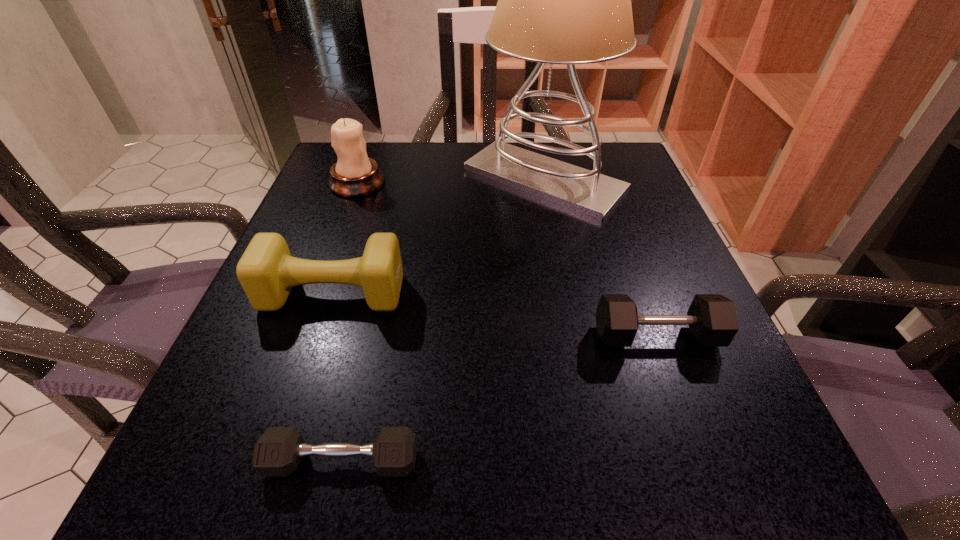
Locate an element on the screen. Image resolution: width=960 pixels, height=540 pixels. the tallest object is located at coordinates (566, 0).

Find the location of `candle holder`. candle holder is located at coordinates 354,174.

Image resolution: width=960 pixels, height=540 pixels. What are the coordinates of `the third shortest object` in the screenshot? It's located at (267, 272).

Where is `the tallest dumbbell`? The width and height of the screenshot is (960, 540). the tallest dumbbell is located at coordinates (267, 272).

Locate an element on the screen. The height and width of the screenshot is (540, 960). the rightmost dumbbell is located at coordinates (712, 320).

Find the location of `the second tallest dumbbell`. the second tallest dumbbell is located at coordinates (712, 320).

Find the location of a particular element. This screenshot has width=960, height=540. the shortest object is located at coordinates (278, 452).

Locate an element on the screen. the nearest dumbbell is located at coordinates (278, 452).

The width and height of the screenshot is (960, 540). I want to click on free space located on the left of the table lamp, so click(393, 179).

Locate an element on the screen. The image size is (960, 540). free spot located 0.270m on the right of the second tallest object is located at coordinates (506, 183).